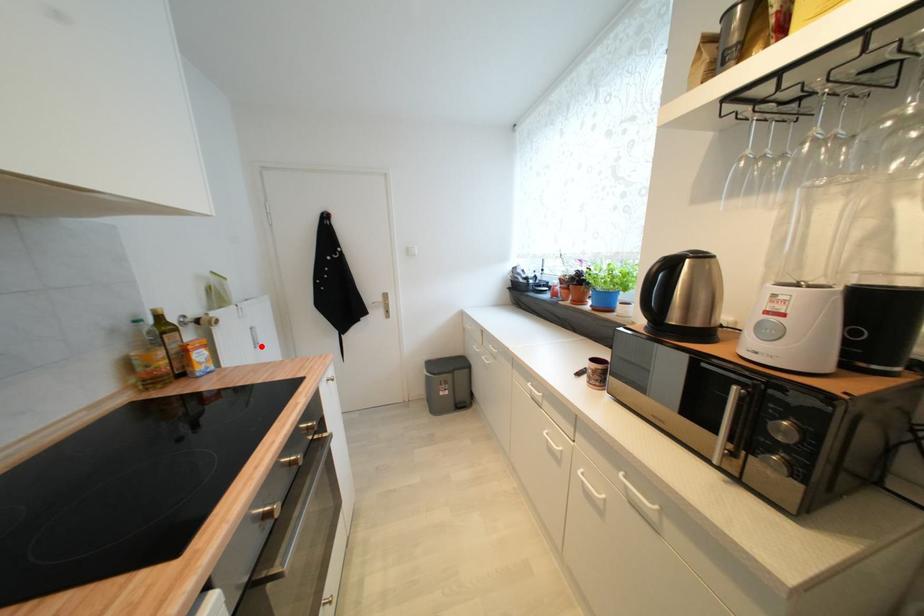
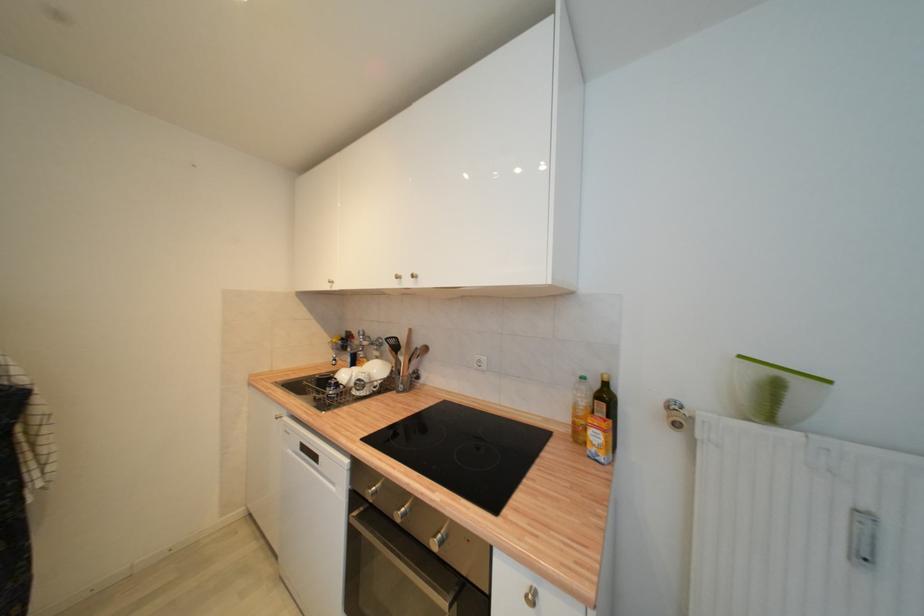
The point at the highlighted location is marked in the first image. Where is the corresponding point in the second image?

(869, 560)